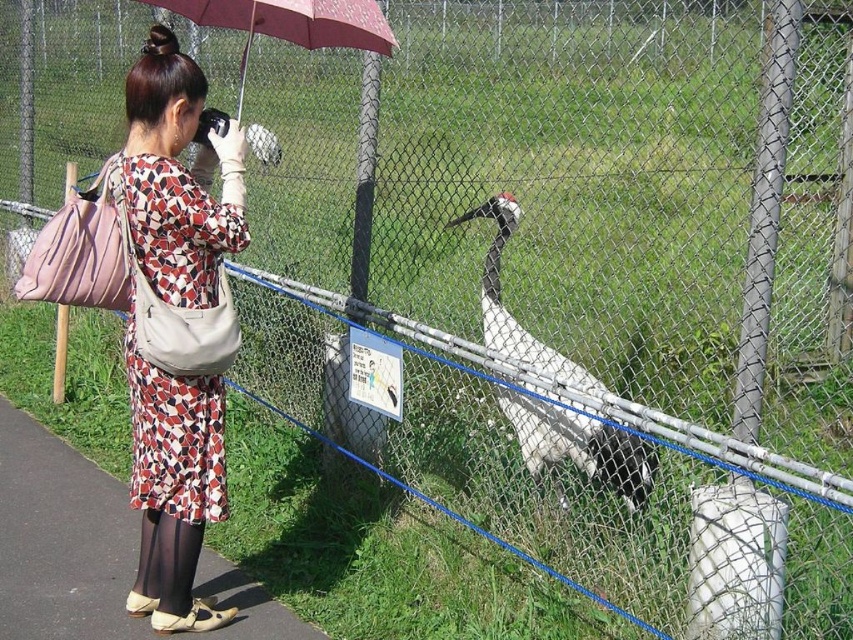
You are a visitor at the wildlife park and want to take a photo of the white glossy bird at center without the maroon fabric umbrella at upper center appearing in the frame. Given that the two objects are 1.08 meters apart, what is the minimum distance you need to move sideways to ensure the umbrella is out of the shot?

The minimum distance you need to move sideways is 1.08 meters to ensure the maroon fabric umbrella at upper center is out of the frame.

You are a photographer trying to capture the crane clearly. The woman in the scene is wearing a printed fabric dress at center and holding a maroon fabric umbrella at upper center. Which object is narrower so that it might not block your view of the crane?

The printed fabric dress at center is narrower than the maroon fabric umbrella at upper center, so it is less likely to block the view of the crane.